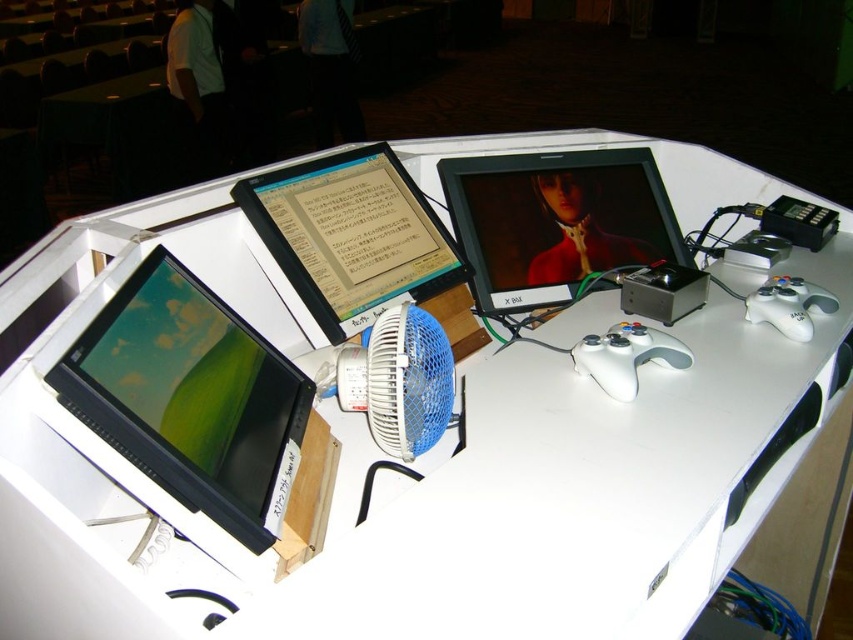
Is matte black monitor at lower left shorter than blue plastic fan at center?

In fact, matte black monitor at lower left may be taller than blue plastic fan at center.

Does matte black monitor at lower left appear over blue plastic fan at center?

Actually, matte black monitor at lower left is below blue plastic fan at center.

Is point (299, 452) positioned after point (416, 323)?

That is False.

The width and height of the screenshot is (853, 640). I want to click on matte black monitor at lower left, so click(190, 397).

Who is more forward, (224, 337) or (488, 310)?

Point (224, 337) is in front.

Find the location of `matte black monitor at lower left`. matte black monitor at lower left is located at coordinates (190, 397).

Is matte black monitor at lower left shorter than matte black monitor at upper center?

Yes, matte black monitor at lower left is shorter than matte black monitor at upper center.

Who is more forward, (155, 321) or (349, 289)?

Point (155, 321) is more forward.

This screenshot has width=853, height=640. What do you see at coordinates (190, 397) in the screenshot? I see `matte black monitor at lower left` at bounding box center [190, 397].

The image size is (853, 640). What are the coordinates of `matte black monitor at lower left` in the screenshot? It's located at (190, 397).